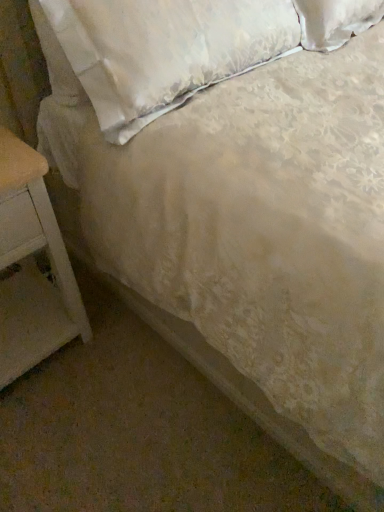
You are a GUI agent. You are given a task and a screenshot of the screen. Output one action in this format:
    pyautogui.click(x=<x>, y=<y>)
    Task: Click on the free space in front of white wood nightstand at lower left
    The width and height of the screenshot is (384, 512).
    Given the screenshot: What is the action you would take?
    pyautogui.click(x=54, y=435)